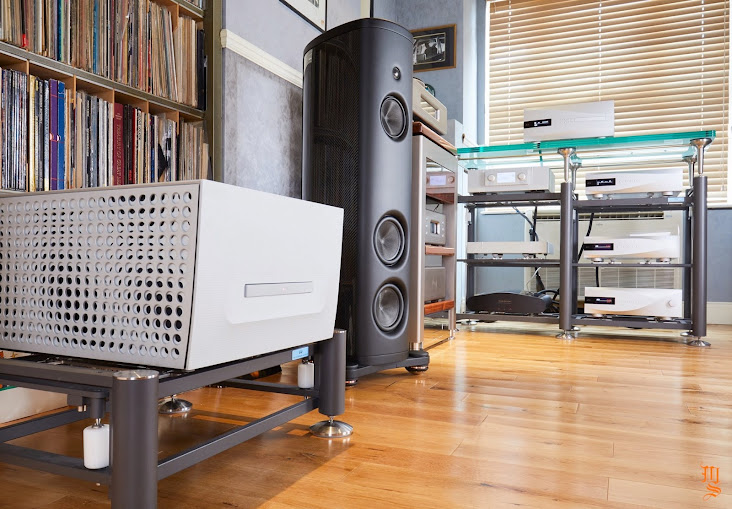
This screenshot has height=509, width=732. Find the location of `glass table top`. glass table top is located at coordinates (623, 142).